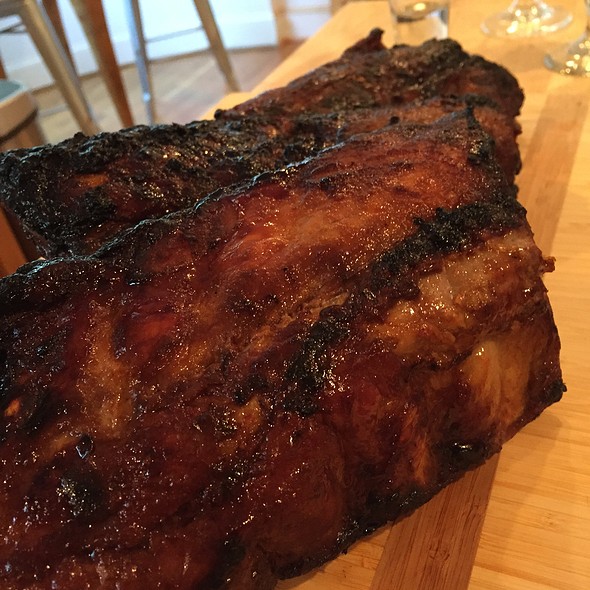
Where is `chair legs`? chair legs is located at coordinates (140, 54), (208, 16).